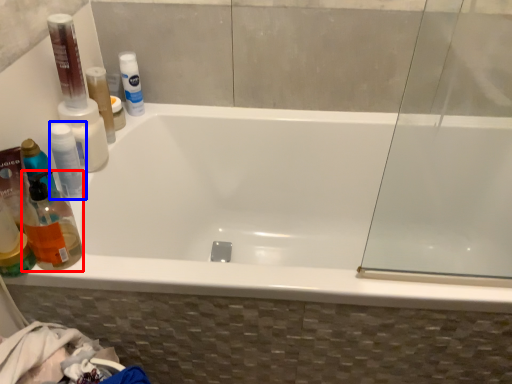
Question: Among these objects, which one is nearest to the camera, cleaning product (highlighted by a red box) or mouthwash (highlighted by a blue box)?

Choices:
 (A) cleaning product
 (B) mouthwash

Answer: (A)